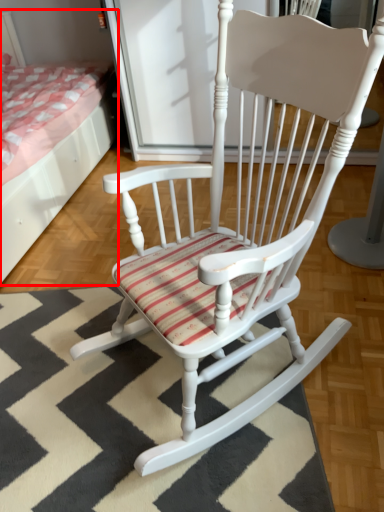
Question: Considering the relative positions of bed (annotated by the red box) and doormat in the image provided, where is bed (annotated by the red box) located with respect to the staircase?

Choices:
 (A) right
 (B) left

Answer: (B)